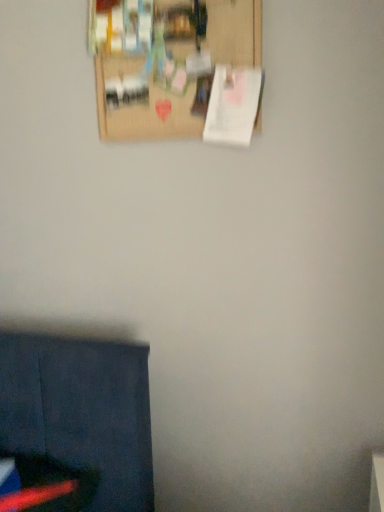
Where is `wooden bulletin board at upper center`? wooden bulletin board at upper center is located at coordinates (177, 69).

What do you see at coordinates (177, 69) in the screenshot?
I see `wooden bulletin board at upper center` at bounding box center [177, 69].

This screenshot has width=384, height=512. I want to click on wooden bulletin board at upper center, so click(177, 69).